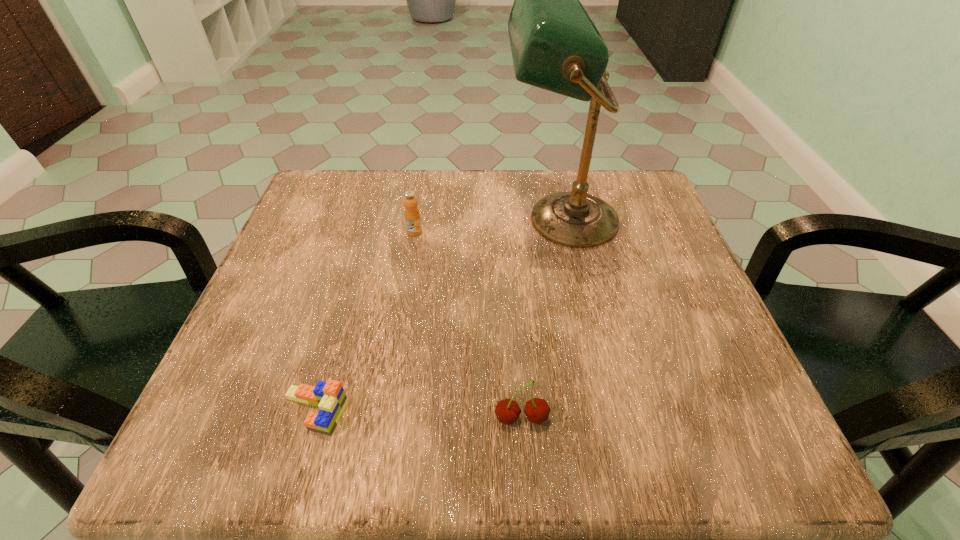
Find the location of a particular element. Image resolution: width=960 pixels, height=540 pixels. unoccupied position between the Lego and the cherry is located at coordinates (419, 415).

Locate an element on the screen. This screenshot has width=960, height=540. unoccupied area between the cherry and the tallest object is located at coordinates (541, 319).

Find the location of a particular element. This screenshot has width=960, height=540. vacant region between the tallest object and the cherry is located at coordinates (541, 319).

Image resolution: width=960 pixels, height=540 pixels. Identify the location of unoccupied position between the tallest object and the orange juice. (488, 226).

At what (x,y) coordinates should I click in order to perform the action: click on object that is the third closest to the leftmost object. Please return your answer as a coordinate pair (x, y). Looking at the image, I should click on (412, 215).

Identify which object is the third closest to the tallest object. Please provide its 2D coordinates. Your answer should be formatted as a tuple, i.e. [(x, y)], where the tuple contains the x and y coordinates of a point satisfying the conditions above.

[(330, 397)]

The height and width of the screenshot is (540, 960). Find the location of `free point that satisfies the following two spatial constraints: 1. above the green lampshade of the table lamp; 2. on the front label of the second object from left to right`. free point that satisfies the following two spatial constraints: 1. above the green lampshade of the table lamp; 2. on the front label of the second object from left to right is located at coordinates (563, 232).

At what (x,y) coordinates should I click in order to perform the action: click on free space that satisfies the following two spatial constraints: 1. above the green lampshade of the table lamp; 2. on the surface of the cherry. Please return your answer as a coordinate pair (x, y). This screenshot has width=960, height=540. Looking at the image, I should click on (602, 418).

Identify the location of vacant space that satisfies the following two spatial constraints: 1. above the green lampshade of the tallest object; 2. on the surface of the cherry. The height and width of the screenshot is (540, 960). (602, 418).

Where is `vacant space that satisfies the following two spatial constraints: 1. above the green lampshade of the tallest object; 2. on the front side of the shortest object`? This screenshot has height=540, width=960. vacant space that satisfies the following two spatial constraints: 1. above the green lampshade of the tallest object; 2. on the front side of the shortest object is located at coordinates (600, 411).